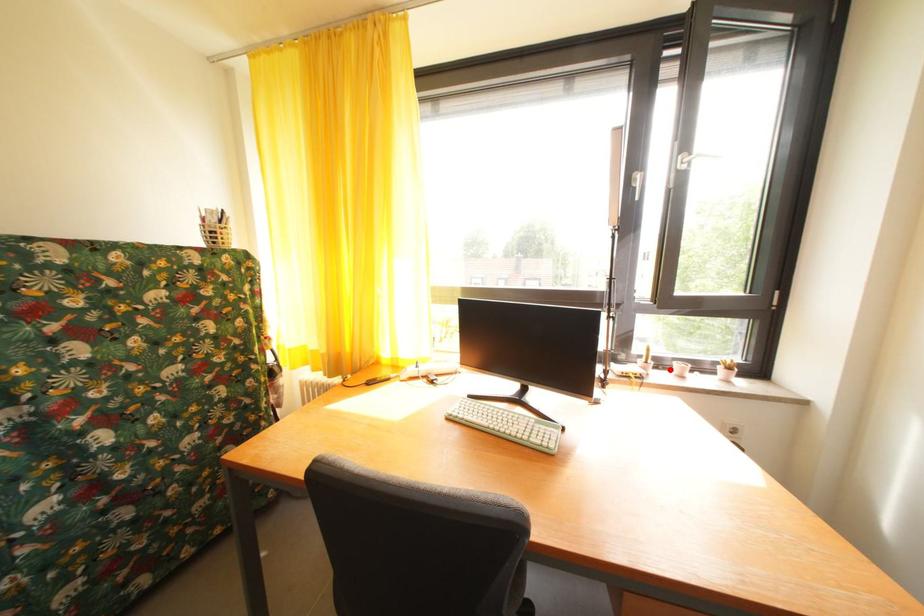
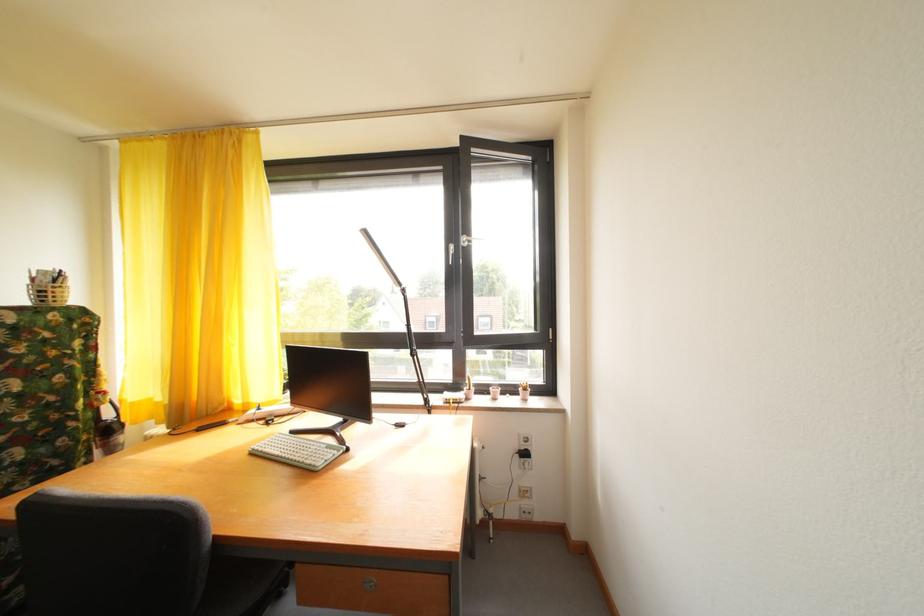
Where in the second image is the point corresponding to the highlighted location from the first image?

(492, 395)